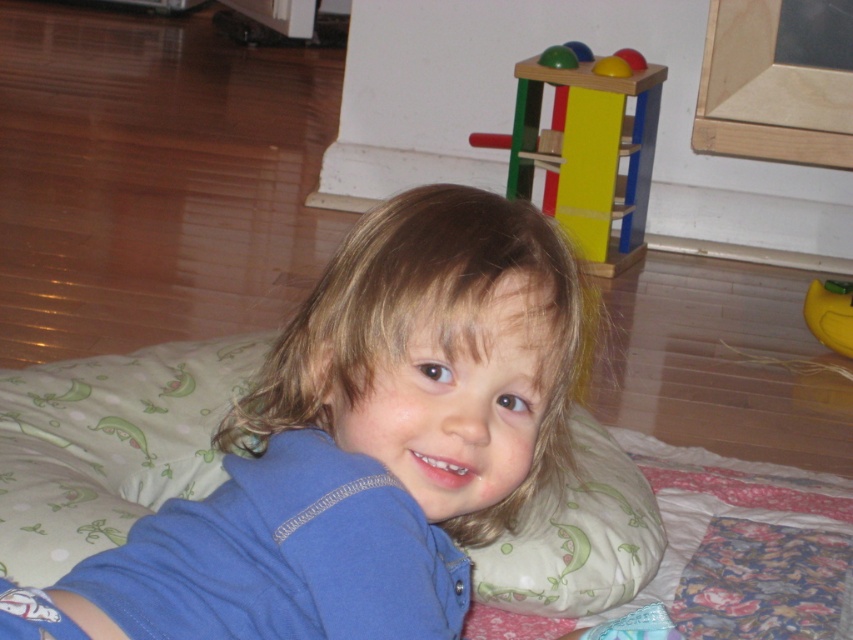
You are standing in the room and want to reach the point at coordinates (819, 339). If you can stretch your arm 2 meters, can you reach it?

The point at coordinates (819, 339) is 2.58 meters away from the viewer. Since your arm can only stretch 2 meters, you cannot reach it.

You are a parent trying to choose a toy for your child to play with. You see a yellow rubber duck at lower right and a green rubber ball at upper center. Which toy is bigger?

The yellow rubber duck at lower right is larger in size than the green rubber ball at upper center.

In the scene shown: You are a photographer trying to capture the blue cotton shirt at center and the smooth yellow cube at upper center in the same frame. Which object should you adjust your camera to focus on first if you want to include both in your shot?

The blue cotton shirt at center is positioned on the left side of smooth yellow cube at upper center. Since the shirt is closer to the camera, you should focus on the blue cotton shirt at center first to ensure both are in the frame.